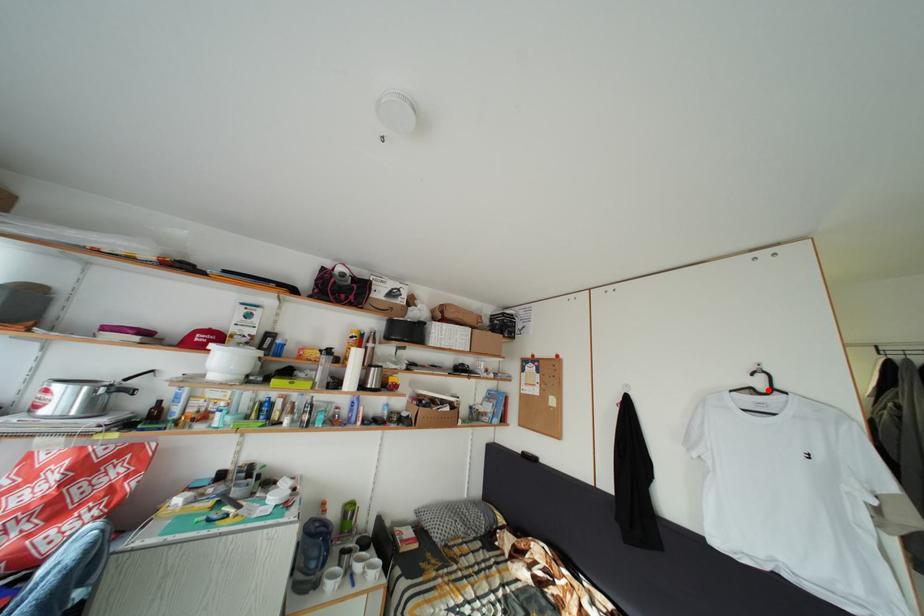
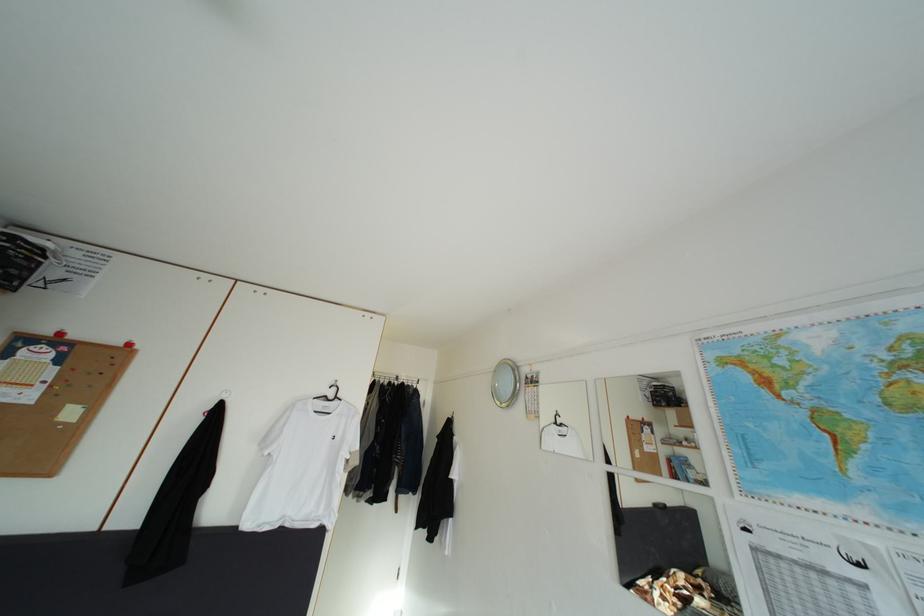
Where in the second image is the point corresponding to the highlighted location from the first image?

(339, 400)